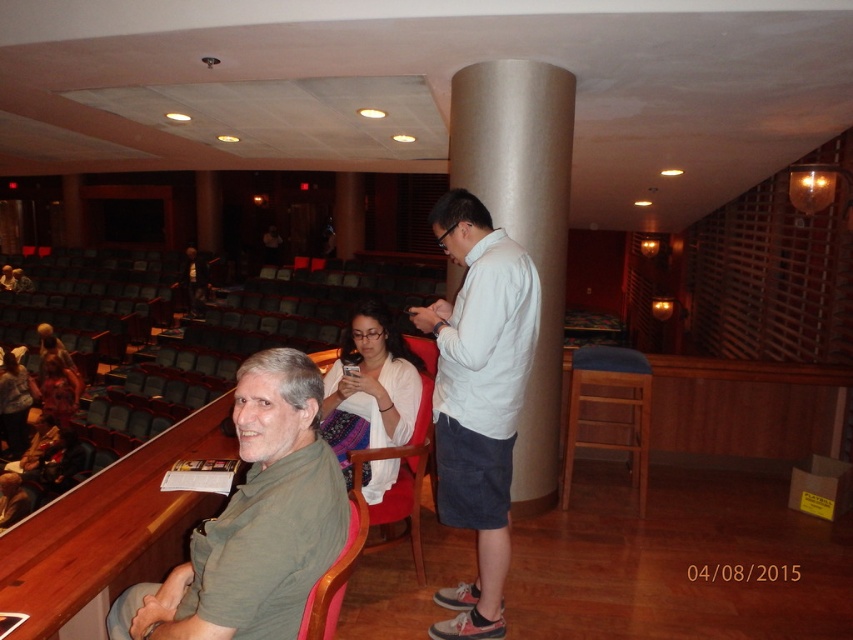
The image size is (853, 640). What do you see at coordinates (254, 522) in the screenshot?
I see `green matte shirt at lower left` at bounding box center [254, 522].

Between point (267, 504) and point (474, 392), which one is positioned in front?

Point (267, 504)

Locate an element on the screen. The image size is (853, 640). green matte shirt at lower left is located at coordinates (254, 522).

Who is more distant from viewer, (509,186) or (347,570)?

Positioned behind is point (509,186).

Does satin silver column at center appear on the right side of wooden chair at lower left?

Correct, you'll find satin silver column at center to the right of wooden chair at lower left.

Does point (532, 244) come behind point (312, 634)?

Yes, point (532, 244) is farther from viewer.

Find the location of a particular element. The image size is (853, 640). satin silver column at center is located at coordinates (523, 224).

Is green matte shirt at lower left to the left of satin silver column at center from the viewer's perspective?

Indeed, green matte shirt at lower left is positioned on the left side of satin silver column at center.

Which is below, green matte shirt at lower left or satin silver column at center?

green matte shirt at lower left is below.

Locate an element on the screen. The image size is (853, 640). green matte shirt at lower left is located at coordinates [254, 522].